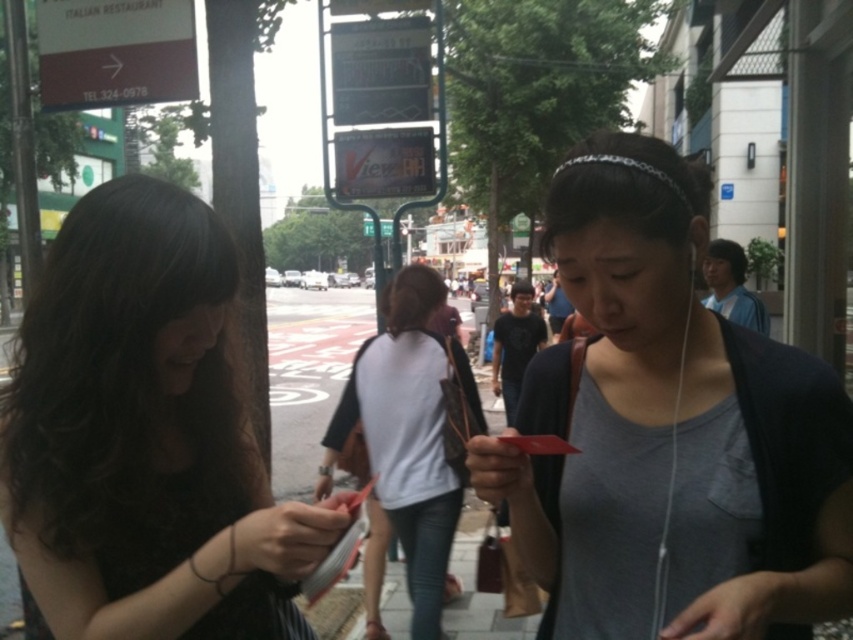
Which of these two, gray matte tank top at center or white cotton shirt at center, stands shorter?

gray matte tank top at center is shorter.

Looking at this image, which is below, gray matte tank top at center or white cotton shirt at center?

white cotton shirt at center is below.

Is point (646, 544) in front of point (408, 352)?

Yes, point (646, 544) is in front of point (408, 352).

In order to click on gray matte tank top at center in this screenshot , I will do `click(764, 490)`.

Does dark brown hair at left appear under white cotton shirt at center?

Incorrect, dark brown hair at left is not positioned below white cotton shirt at center.

Measure the distance between dark brown hair at left and camera.

dark brown hair at left is 38.72 inches away from camera.

Is point (165, 275) behind point (425, 300)?

No, (165, 275) is closer to viewer.

Identify the location of dark brown hair at left. (143, 435).

Does dark brown hair at left have a greater height compared to gray matte tank top at center?

No, dark brown hair at left is not taller than gray matte tank top at center.

Is point (167, 481) farther from viewer compared to point (647, 385)?

No, (167, 481) is closer to viewer.

At what (x,y) coordinates should I click in order to perform the action: click on dark brown hair at left. Please return your answer as a coordinate pair (x, y). This screenshot has height=640, width=853. Looking at the image, I should click on (143, 435).